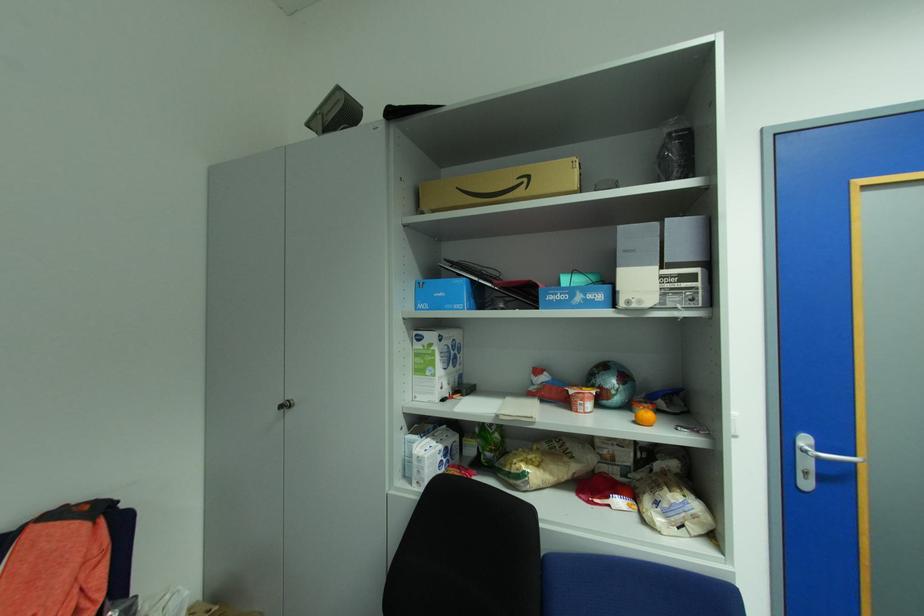
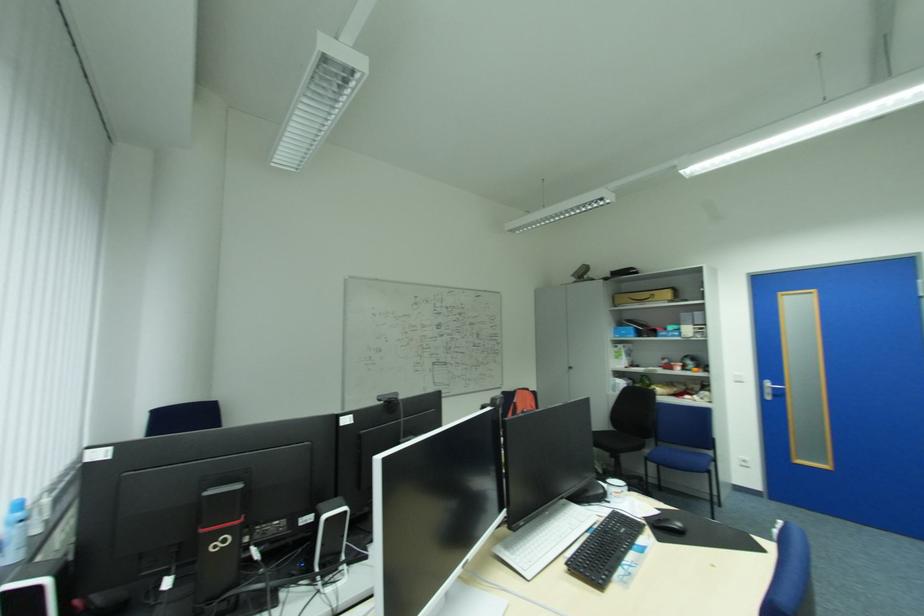
The point at (535, 177) is marked in the first image. Where is the corresponding point in the second image?

(659, 294)